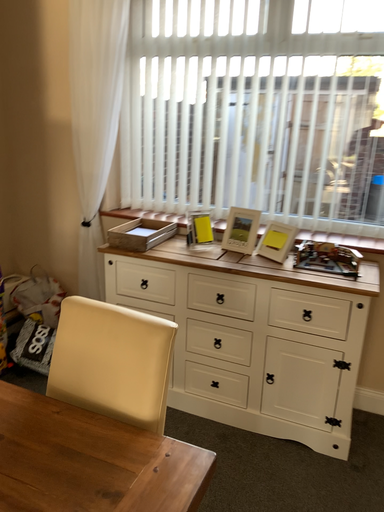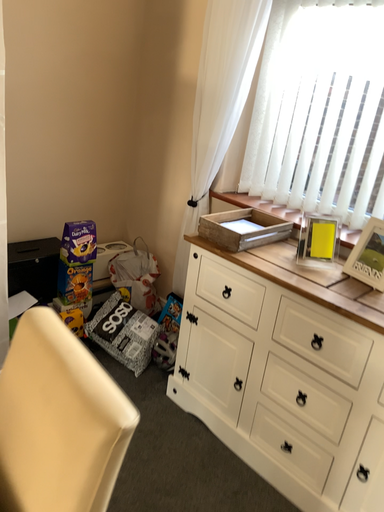
Question: Which way did the camera rotate in the video?

Choices:
 (A) rotated right
 (B) rotated left

Answer: (B)